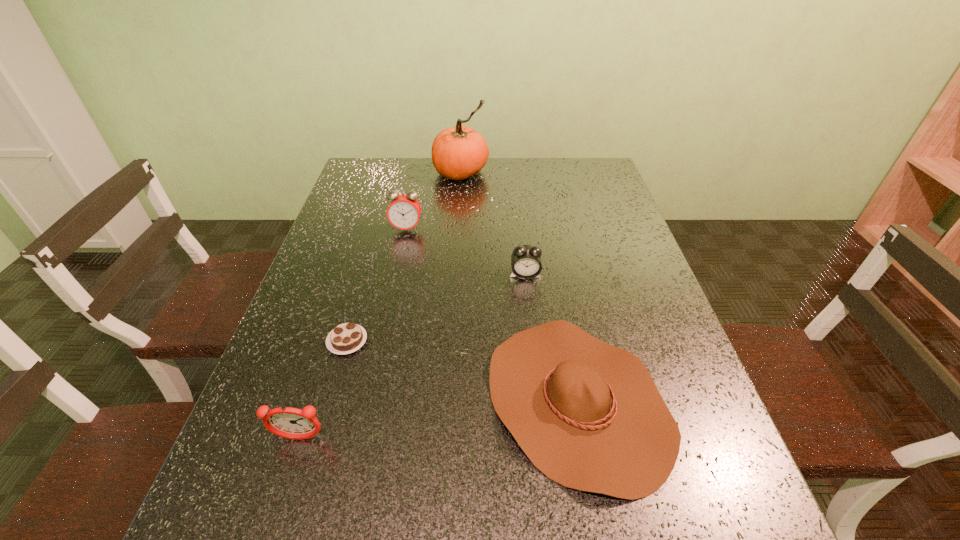
Locate an element on the screen. the tallest object is located at coordinates (458, 153).

At what (x,y) coordinates should I click in order to perform the action: click on the farthest object. Please return your answer as a coordinate pair (x, y). This screenshot has width=960, height=540. Looking at the image, I should click on (458, 153).

Where is `the tallest alarm clock`? the tallest alarm clock is located at coordinates (404, 211).

You are a GUI agent. You are given a task and a screenshot of the screen. Output one action in this format:
    pyautogui.click(x=<x>, y=<y>)
    Task: Click on the farthest alarm clock
    This screenshot has height=540, width=960.
    Given the screenshot: What is the action you would take?
    pyautogui.click(x=404, y=211)

The width and height of the screenshot is (960, 540). Identify the location of the leftmost alarm clock. (287, 422).

Where is `the second nearest alarm clock`? The image size is (960, 540). the second nearest alarm clock is located at coordinates (526, 263).

Locate an element on the screen. This screenshot has width=960, height=540. the rightmost alarm clock is located at coordinates (526, 263).

Where is `the fifth tallest object`? The height and width of the screenshot is (540, 960). the fifth tallest object is located at coordinates (588, 415).

Locate an element on the screen. The width and height of the screenshot is (960, 540). the shortest object is located at coordinates (346, 338).

The height and width of the screenshot is (540, 960). Find the location of `free spot located 0.390m on the right of the tallest object`. free spot located 0.390m on the right of the tallest object is located at coordinates pos(604,172).